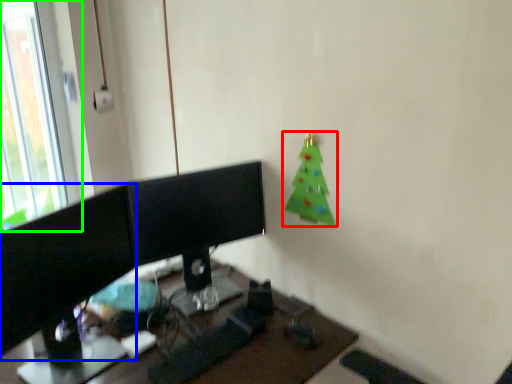
Question: Which object is the farthest from christmas tree (highlighted by a red box)? Choose among these: computer monitor (highlighted by a blue box) or window (highlighted by a green box).

Choices:
 (A) computer monitor
 (B) window

Answer: (B)